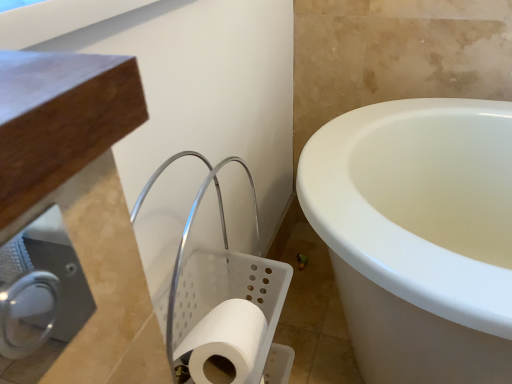
Question: Is white matte toilet paper at lower center at the left side of satin silver toilet paper holder at lower left?

Choices:
 (A) yes
 (B) no

Answer: (B)

Question: Does white matte toilet paper at lower center have a larger size compared to satin silver toilet paper holder at lower left?

Choices:
 (A) yes
 (B) no

Answer: (A)

Question: Does white matte toilet paper at lower center have a lesser width compared to satin silver toilet paper holder at lower left?

Choices:
 (A) no
 (B) yes

Answer: (A)

Question: Considering the relative sizes of white matte toilet paper at lower center and satin silver toilet paper holder at lower left in the image provided, is white matte toilet paper at lower center taller than satin silver toilet paper holder at lower left?

Choices:
 (A) no
 (B) yes

Answer: (B)

Question: Does white matte toilet paper at lower center turn towards satin silver toilet paper holder at lower left?

Choices:
 (A) no
 (B) yes

Answer: (A)

Question: Can you confirm if white matte toilet paper at lower center is smaller than satin silver toilet paper holder at lower left?

Choices:
 (A) no
 (B) yes

Answer: (A)

Question: From the image's perspective, would you say satin silver toilet paper holder at lower left is positioned over white matte toilet paper at lower center?

Choices:
 (A) no
 (B) yes

Answer: (B)

Question: Is satin silver toilet paper holder at lower left not close to white matte toilet paper at lower center?

Choices:
 (A) yes
 (B) no

Answer: (B)

Question: From the image's perspective, is satin silver toilet paper holder at lower left located beneath white matte toilet paper at lower center?

Choices:
 (A) yes
 (B) no

Answer: (B)

Question: Considering the relative sizes of satin silver toilet paper holder at lower left and white matte toilet paper at lower center in the image provided, is satin silver toilet paper holder at lower left bigger than white matte toilet paper at lower center?

Choices:
 (A) yes
 (B) no

Answer: (B)

Question: From a real-world perspective, is satin silver toilet paper holder at lower left below white matte toilet paper at lower center?

Choices:
 (A) yes
 (B) no

Answer: (B)

Question: Considering the relative sizes of satin silver toilet paper holder at lower left and white matte toilet paper at lower center in the image provided, is satin silver toilet paper holder at lower left thinner than white matte toilet paper at lower center?

Choices:
 (A) yes
 (B) no

Answer: (A)

Question: Considering the positions of satin silver toilet paper holder at lower left and white matte toilet paper at lower center in the image, is satin silver toilet paper holder at lower left bigger or smaller than white matte toilet paper at lower center?

Choices:
 (A) big
 (B) small

Answer: (B)